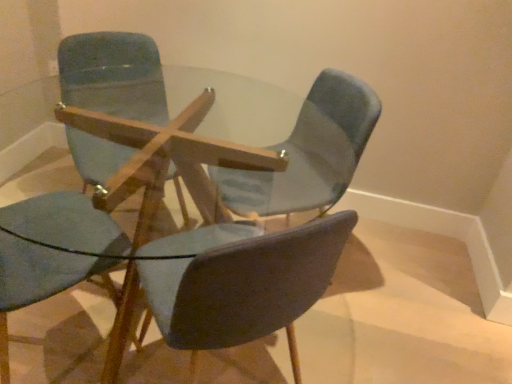
Question: Is matte blue chair at center, which is counted as the 3th chair, starting from the left, in front of or behind light blue fabric chair at center, which is the first chair from right to left, in the image?

Choices:
 (A) front
 (B) behind

Answer: (A)

Question: From the image's perspective, is matte blue chair at center, which is the second chair in right-to-left order, above or below light blue fabric chair at center, which is the first chair from right to left?

Choices:
 (A) above
 (B) below

Answer: (B)

Question: Estimate the real-world distances between objects in this image. Which object is closer to the light blue fabric chair at center, which is the first chair from right to left?

Choices:
 (A) matte blue chair at upper left, marked as the 2th chair in a left-to-right arrangement
 (B) matte blue chair at center, which is counted as the 3th chair, starting from the left
 (C) matte blue chair at upper left, the fourth chair viewed from the right

Answer: (C)

Question: Which object is the closest to the light blue fabric chair at center, marked as the fourth chair in a left-to-right arrangement?

Choices:
 (A) matte blue chair at center, which is the second chair in right-to-left order
 (B) matte blue chair at upper left, the fourth chair viewed from the right
 (C) matte blue chair at upper left, the 3th chair positioned from the right

Answer: (B)